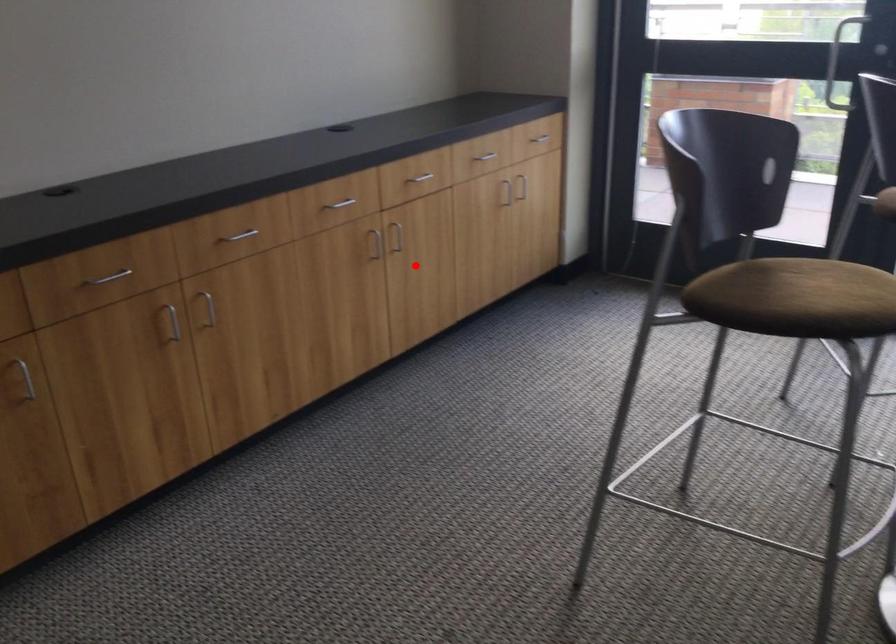
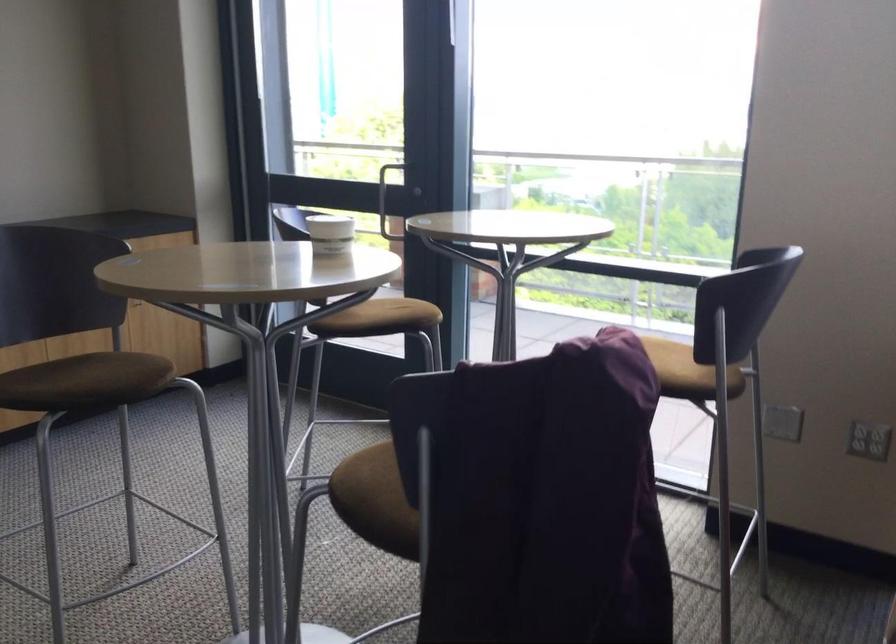
Find the pixel in the second image that matches the highlighted location in the first image.

(76, 344)